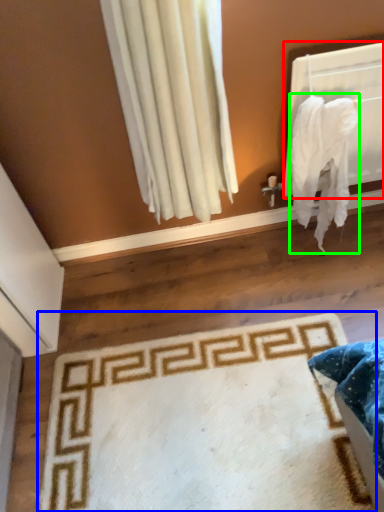
Question: Estimate the real-world distances between objects in this image. Which object is farther from window screen (highlighted by a red box), mat (highlighted by a blue box) or blanket (highlighted by a green box)?

Choices:
 (A) mat
 (B) blanket

Answer: (A)